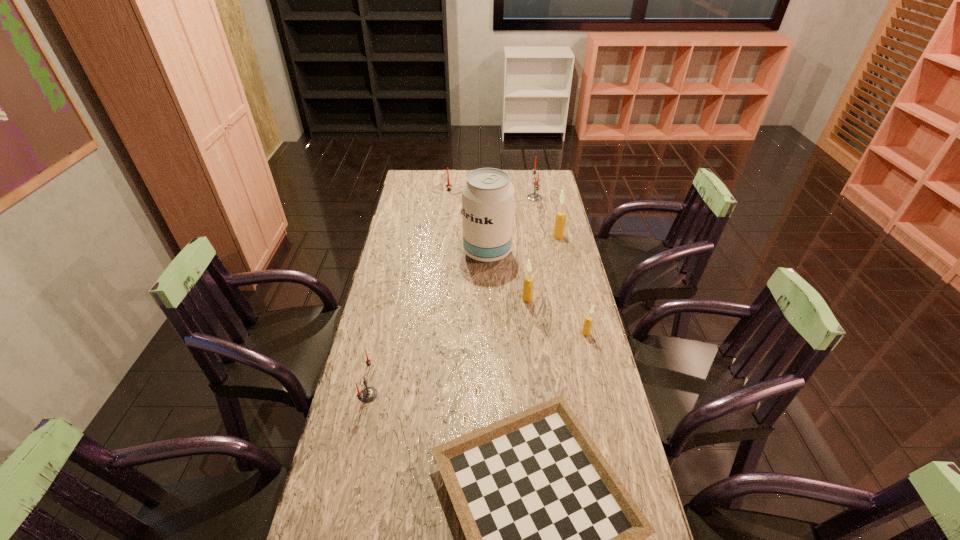
Where is `alcohol`? The height and width of the screenshot is (540, 960). alcohol is located at coordinates (487, 195).

You are a GUI agent. You are given a task and a screenshot of the screen. Output one action in this format:
    pyautogui.click(x=<x>, y=<y>)
    Task: Click on the fifth candle from right to left
    Image resolution: width=960 pixels, height=540 pixels.
    Given the screenshot: What is the action you would take?
    448,185

I want to click on the biggest red candle, so coord(448,185).

Find the location of a particular element. This screenshot has height=540, width=960. the third farthest candle is located at coordinates (560, 219).

The height and width of the screenshot is (540, 960). I want to click on the farthest cream candle, so click(560, 219).

Locate an element on the screen. This screenshot has width=960, height=540. the second smallest red candle is located at coordinates (534, 196).

This screenshot has width=960, height=540. Identify the location of the third candle from right to left. (534, 196).

Where is `the second farthest cream candle`? the second farthest cream candle is located at coordinates (528, 282).

In order to click on the fifth farthest object in this screenshot , I will do click(528, 282).

The width and height of the screenshot is (960, 540). Find the location of `the fifth farthest candle`. the fifth farthest candle is located at coordinates (588, 321).